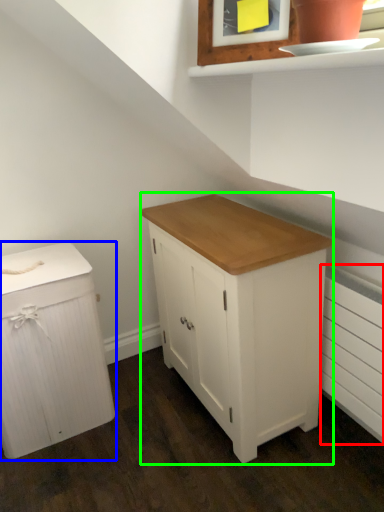
Question: Based on their relative distances, which object is nearer to radiator (highlighted by a red box)? Choose from chest of drawers (highlighted by a blue box) and chest of drawers (highlighted by a green box).

Choices:
 (A) chest of drawers
 (B) chest of drawers

Answer: (B)